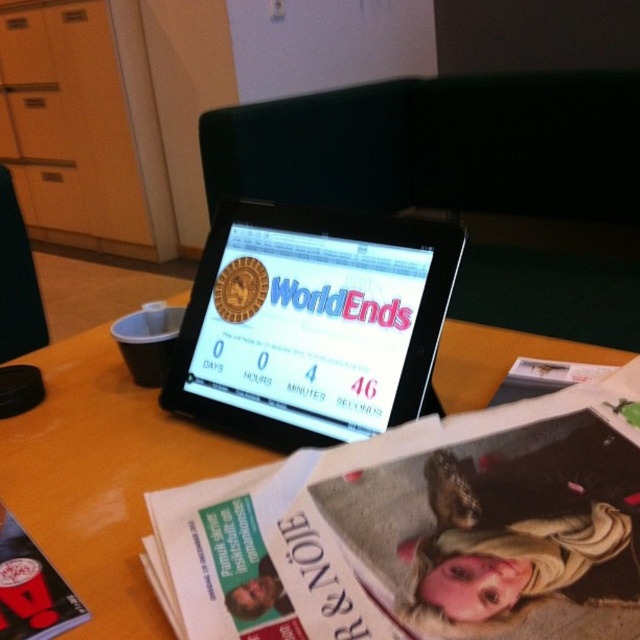
You are a person sitting at the table and want to pick up the matte black magazine at lower left. Can you reach it without moving the black glossy tablet at center?

The black glossy tablet at center is further to the viewer than matte black magazine at lower left, so the tablet is closer to you. Since the tablet is in front of the magazine, you can reach the matte black magazine at lower left without needing to move the tablet.

You are a customer at a cafe trying to use the black glossy tablet at center to check the time. However, you notice the tablet is placed under the wooden table at center. Can you easily access the tablet from your current position?

The black glossy tablet at center is positioned under the wooden table at center, so it might be difficult to access easily from your current position as it is located underneath the table.

You are a customer in a cafe and want to place your coffee cup on the wooden table at center. However, there is a matte black magazine at lower left in the way. Can you move the magazine to make space?

The wooden table at center is above the matte black magazine at lower left, which means the magazine is underneath the table. Since the magazine is not on top of the table, you can place your coffee cup directly on the wooden table at center without needing to move the magazine.